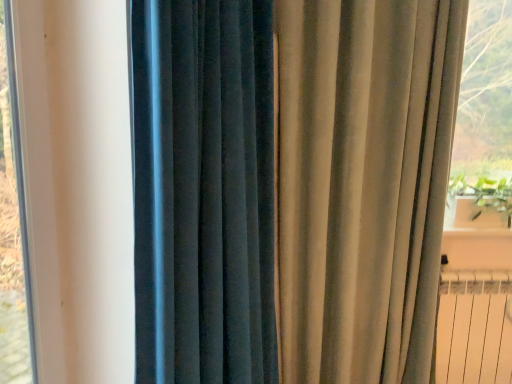
Question: Considering the relative sizes of green leafy plant at right and satin beige curtain at right, which is the 2th curtain in left-to-right order, in the image provided, is green leafy plant at right taller than satin beige curtain at right, which is the 2th curtain in left-to-right order,?

Choices:
 (A) no
 (B) yes

Answer: (A)

Question: Can you confirm if green leafy plant at right is smaller than satin beige curtain at right, the 1th curtain viewed from the right?

Choices:
 (A) no
 (B) yes

Answer: (B)

Question: Considering the relative sizes of green leafy plant at right and satin beige curtain at right, which is the 2th curtain in left-to-right order, in the image provided, is green leafy plant at right bigger than satin beige curtain at right, which is the 2th curtain in left-to-right order,?

Choices:
 (A) no
 (B) yes

Answer: (A)

Question: Is green leafy plant at right positioned beyond the bounds of satin beige curtain at right, which is the 2th curtain in left-to-right order?

Choices:
 (A) yes
 (B) no

Answer: (A)

Question: Can you confirm if green leafy plant at right is shorter than satin beige curtain at right, which is the 2th curtain in left-to-right order?

Choices:
 (A) yes
 (B) no

Answer: (A)

Question: From the image's perspective, is white plastic window frame at left located above or below satin beige curtain at right, the 1th curtain viewed from the right?

Choices:
 (A) below
 (B) above

Answer: (B)

Question: Considering the positions of white plastic window frame at left and satin beige curtain at right, which is the 2th curtain in left-to-right order, in the image, is white plastic window frame at left wider or thinner than satin beige curtain at right, which is the 2th curtain in left-to-right order,?

Choices:
 (A) thin
 (B) wide

Answer: (A)

Question: From a real-world perspective, is white plastic window frame at left physically located above or below satin beige curtain at right, which is the 2th curtain in left-to-right order?

Choices:
 (A) above
 (B) below

Answer: (A)

Question: Is white plastic window frame at left spatially inside satin beige curtain at right, which is the 2th curtain in left-to-right order, or outside of it?

Choices:
 (A) inside
 (B) outside

Answer: (B)

Question: In terms of width, does green leafy plant at right look wider or thinner when compared to white metallic radiator at lower right?

Choices:
 (A) wide
 (B) thin

Answer: (A)

Question: Is green leafy plant at right taller or shorter than white metallic radiator at lower right?

Choices:
 (A) short
 (B) tall

Answer: (A)

Question: From the image's perspective, relative to white metallic radiator at lower right, is green leafy plant at right above or below?

Choices:
 (A) below
 (B) above

Answer: (B)

Question: Would you say green leafy plant at right is to the left or to the right of white metallic radiator at lower right in the picture?

Choices:
 (A) left
 (B) right

Answer: (B)

Question: In terms of width, does green leafy plant at right look wider or thinner when compared to satin beige curtain at right, the 1th curtain viewed from the right?

Choices:
 (A) wide
 (B) thin

Answer: (A)

Question: Is point (480, 180) closer or farther from the camera than point (161, 317)?

Choices:
 (A) closer
 (B) farther

Answer: (B)